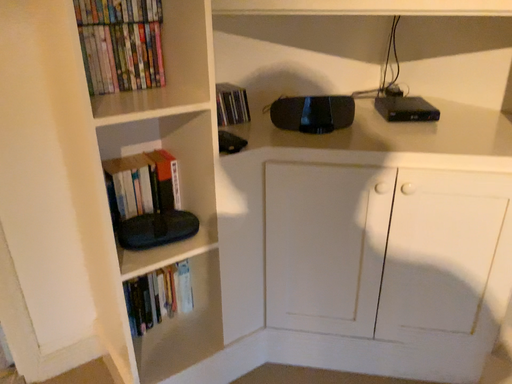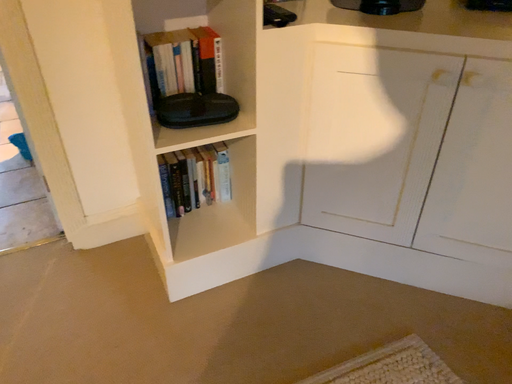
Question: Which way did the camera rotate in the video?

Choices:
 (A) rotated right
 (B) rotated left

Answer: (B)